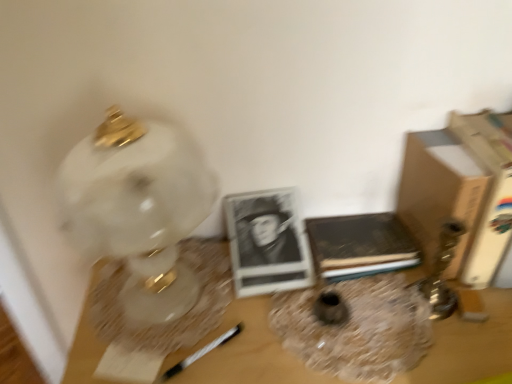
Where is `vacant space positioned to the left of translucent glass vase at center, which is counted as the first vase, starting from the right`? Image resolution: width=512 pixels, height=384 pixels. vacant space positioned to the left of translucent glass vase at center, which is counted as the first vase, starting from the right is located at coordinates (240, 324).